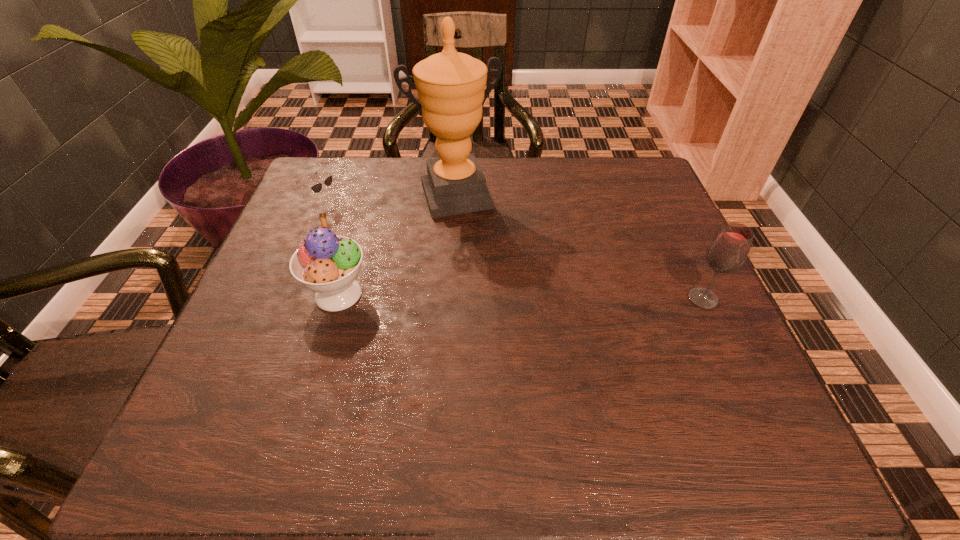
At what (x,y) coordinates should I click in order to perform the action: click on vacant space positioned at the front of the award with handles. Please return your answer as a coordinate pair (x, y). The image size is (960, 540). Looking at the image, I should click on (479, 256).

The image size is (960, 540). What are the coordinates of `vacant region located at the front of the award with handles` in the screenshot? It's located at (488, 279).

This screenshot has height=540, width=960. Identify the location of free space located 0.200m at the front of the award with handles. (487, 275).

This screenshot has width=960, height=540. Find the location of `sunglasses present at the far edge`. sunglasses present at the far edge is located at coordinates (316, 188).

This screenshot has height=540, width=960. Find the location of `award present at the far edge`. award present at the far edge is located at coordinates (451, 90).

This screenshot has height=540, width=960. What are the coordinates of `icecream located in the left edge section of the desktop` in the screenshot? It's located at (328, 264).

Where is `sunglasses that is at the left edge`? sunglasses that is at the left edge is located at coordinates 316,188.

Identify the location of object that is at the right edge. (728, 251).

Find the location of `object located at the far left corner`. object located at the far left corner is located at coordinates (316, 188).

Find the location of a particular element. vacant space at the far edge of the desktop is located at coordinates (517, 185).